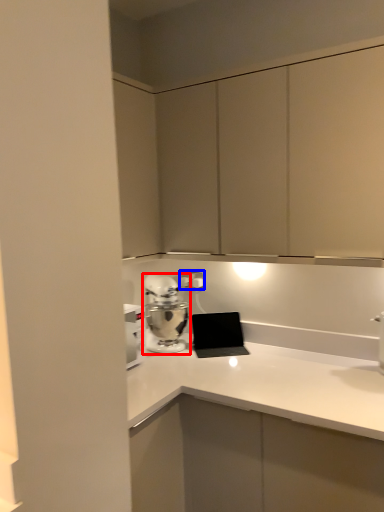
Question: Which of the following is the closest to the observer, home appliance (highlighted by a red box) or electric outlet (highlighted by a blue box)?

Choices:
 (A) home appliance
 (B) electric outlet

Answer: (A)